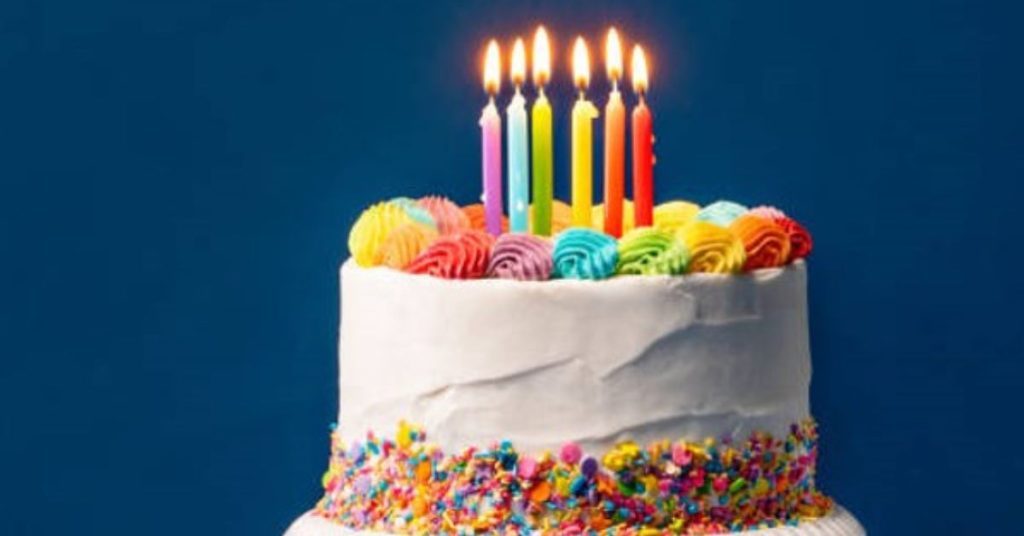
Identify the location of candle wicks. This screenshot has width=1024, height=536. (492, 96), (517, 87), (544, 89), (582, 90), (612, 84), (640, 98).